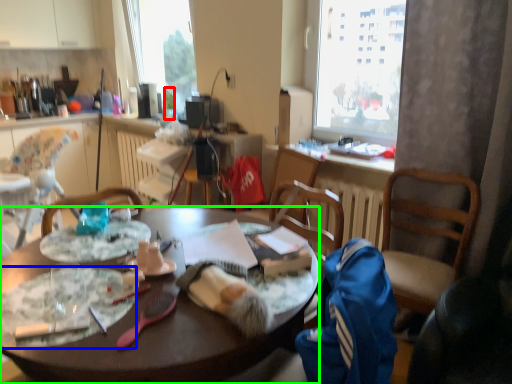
Question: Based on their relative distances, which object is nearer to bottle (highlighted by a red box)? Choose from plate (highlighted by a blue box) and desk (highlighted by a green box).

Choices:
 (A) plate
 (B) desk

Answer: (B)